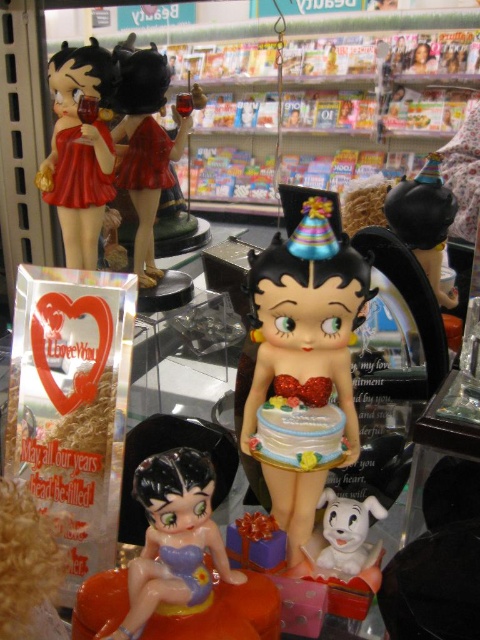
Is shiny black figurine at upper right wider than white glossy dog at lower center?

Yes.

Between shiny black figurine at upper right and white glossy dog at lower center, which one is positioned higher?

shiny black figurine at upper right is above.

Does point (417, 220) lie in front of point (338, 557)?

No, it is not.

This screenshot has height=640, width=480. In order to click on shiny black figurine at upper right in this screenshot , I will do `click(423, 220)`.

Where is `shiny plastic figurine at center`? This screenshot has width=480, height=640. shiny plastic figurine at center is located at coordinates (307, 314).

Does shiny plastic figurine at center have a greater height compared to matte plastic figurine at upper left?

Correct, shiny plastic figurine at center is much taller as matte plastic figurine at upper left.

Where is `shiny plastic figurine at center`? Image resolution: width=480 pixels, height=640 pixels. shiny plastic figurine at center is located at coordinates click(307, 314).

Does matte plastic figurine at upper left come in front of smooth white cake at center?

No, matte plastic figurine at upper left is behind smooth white cake at center.

How far apart are matte plastic figurine at upper left and smooth white cake at center?

53.96 centimeters

What do you see at coordinates (81, 148) in the screenshot?
I see `matte plastic figurine at upper left` at bounding box center [81, 148].

This screenshot has width=480, height=640. In order to click on matte plastic figurine at upper left in this screenshot , I will do `click(81, 148)`.